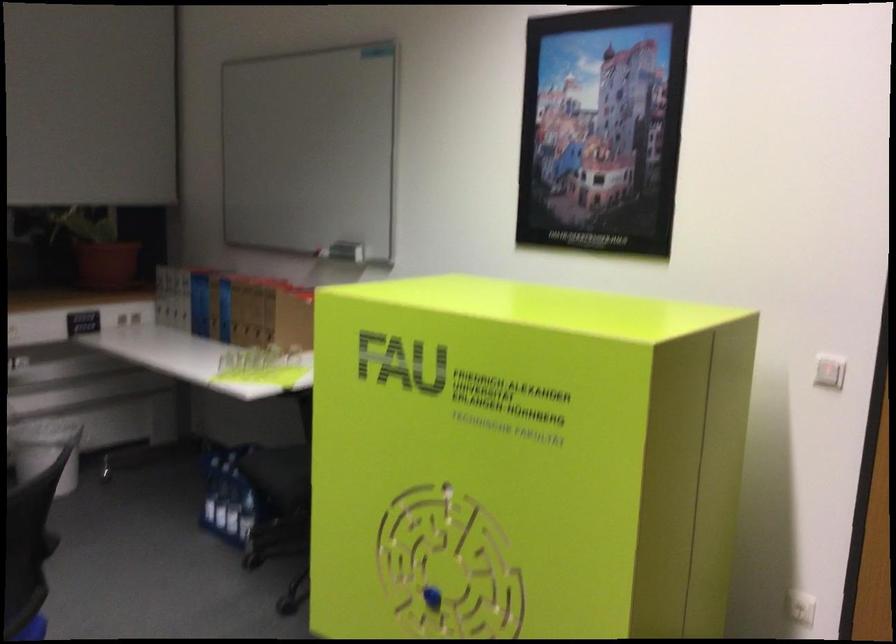
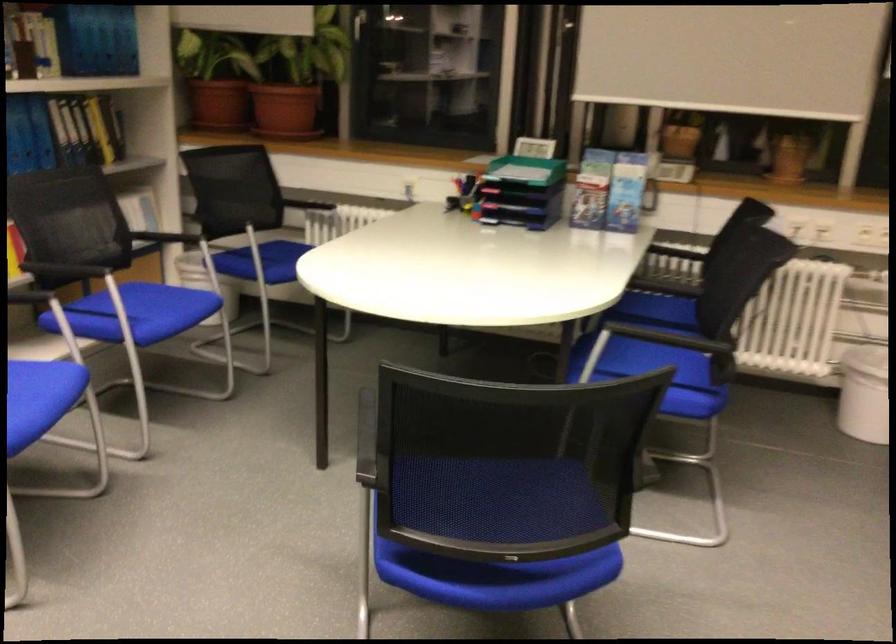
Question: The first image is from the beginning of the video and the second image is from the end. How did the camera likely rotate when shooting the video?

Choices:
 (A) Left
 (B) Right
 (C) Up
 (D) Down

Answer: (A)